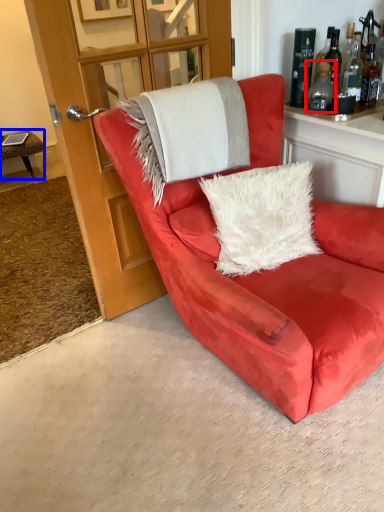
Question: Which object is closer to the camera taking this photo, bottle (highlighted by a red box) or table (highlighted by a blue box)?

Choices:
 (A) bottle
 (B) table

Answer: (A)